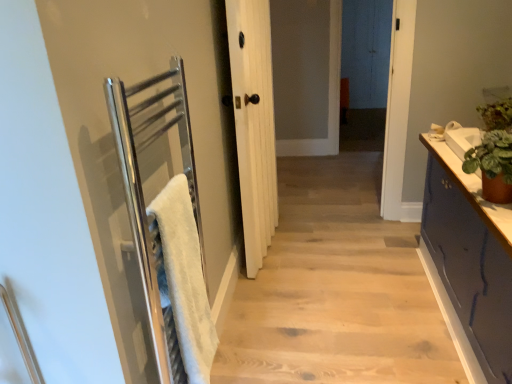
Question: Should I look upward or downward to see dark blue painted cabinet at right?

Choices:
 (A) down
 (B) up

Answer: (A)

Question: Does white fluffy bath towel at left have a greater height compared to dark blue painted cabinet at right?

Choices:
 (A) yes
 (B) no

Answer: (A)

Question: Does white fluffy bath towel at left have a larger size compared to dark blue painted cabinet at right?

Choices:
 (A) yes
 (B) no

Answer: (B)

Question: Does white fluffy bath towel at left lie behind dark blue painted cabinet at right?

Choices:
 (A) no
 (B) yes

Answer: (B)

Question: Is white fluffy bath towel at left surrounding dark blue painted cabinet at right?

Choices:
 (A) no
 (B) yes

Answer: (A)

Question: Does white fluffy bath towel at left lie in front of dark blue painted cabinet at right?

Choices:
 (A) no
 (B) yes

Answer: (A)

Question: Considering the relative sizes of white fluffy bath towel at left and dark blue painted cabinet at right in the image provided, is white fluffy bath towel at left thinner than dark blue painted cabinet at right?

Choices:
 (A) no
 (B) yes

Answer: (B)

Question: Considering the relative sizes of green matte plant pot at right and white fluffy bath towel at left in the image provided, is green matte plant pot at right shorter than white fluffy bath towel at left?

Choices:
 (A) no
 (B) yes

Answer: (B)

Question: From a real-world perspective, is green matte plant pot at right positioned over white fluffy bath towel at left based on gravity?

Choices:
 (A) no
 (B) yes

Answer: (B)

Question: From the image's perspective, is green matte plant pot at right below white fluffy bath towel at left?

Choices:
 (A) yes
 (B) no

Answer: (B)

Question: Is green matte plant pot at right directly adjacent to white fluffy bath towel at left?

Choices:
 (A) no
 (B) yes

Answer: (A)

Question: Could you tell me if green matte plant pot at right is turned towards white fluffy bath towel at left?

Choices:
 (A) no
 (B) yes

Answer: (A)

Question: Is green matte plant pot at right outside white fluffy bath towel at left?

Choices:
 (A) no
 (B) yes

Answer: (B)

Question: From the image's perspective, is green matte plant pot at right above green leafy plant at right?

Choices:
 (A) no
 (B) yes

Answer: (A)